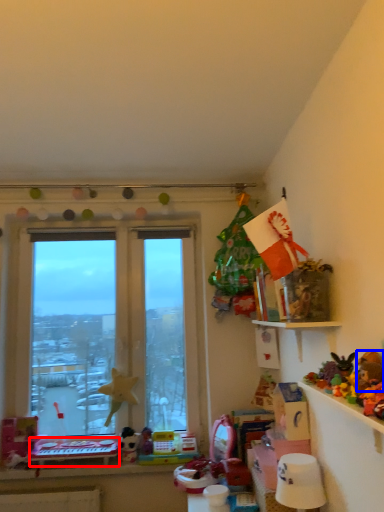
Question: Which object appears closest to the camera in this image, table (highlighted by a red box) or toy (highlighted by a blue box)?

Choices:
 (A) table
 (B) toy

Answer: (B)